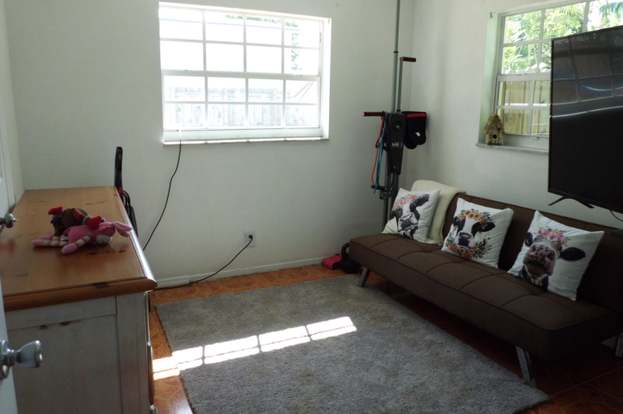
Image resolution: width=623 pixels, height=414 pixels. I want to click on throw pillows, so click(x=429, y=209), click(x=488, y=235), click(x=563, y=278).